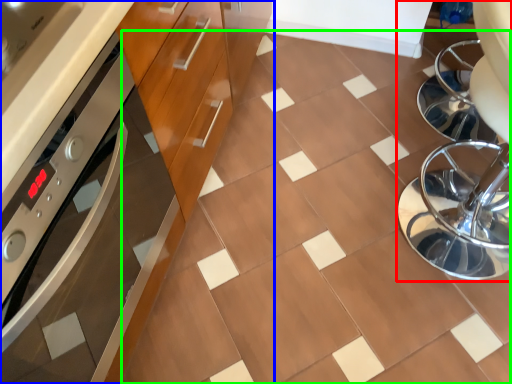
Question: Based on their relative distances, which object is nearer to swivel chair (highlighted by a red box)? Choose from cabinetry (highlighted by a blue box) and ceramic tile (highlighted by a green box).

Choices:
 (A) cabinetry
 (B) ceramic tile

Answer: (B)